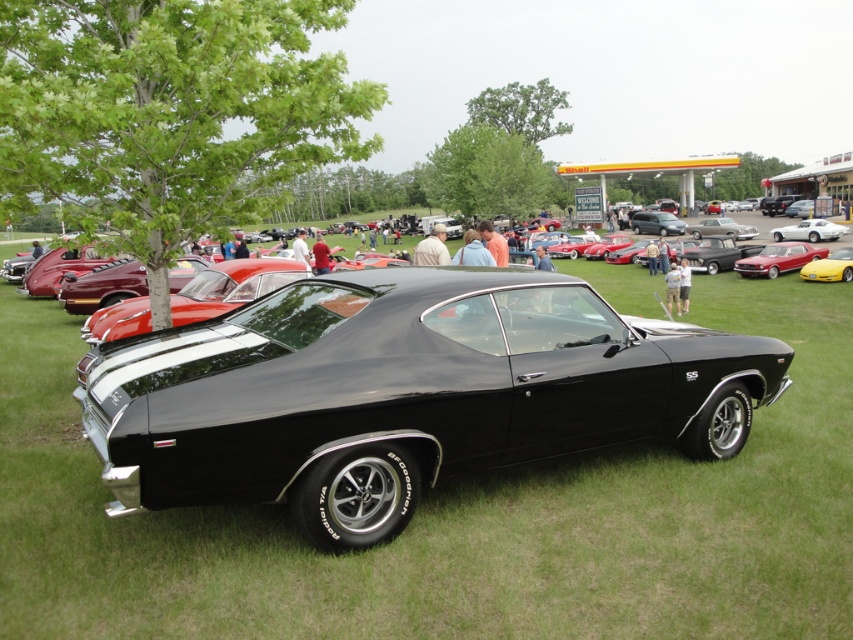
You are a photographer positioned at the origin point of the coordinate system. You want to capture a photo of the black glossy car at center. Which direction should you move to get closer to the car?

The black glossy car at center is located at point (405,394), so you should move towards the positive x and positive y direction to get closer to the car.

You are a photographer trying to capture a wide shot of the car show. You need to position yourself so that both the shiny red car at center right and the shiny silver sedan at center are fully visible in your frame. Given their widths, which car will require you to stand further back to ensure it fits entirely in the photo?

The shiny silver sedan at center is wider than the shiny red car at center right. To ensure the wider shiny silver sedan at center fits entirely in the photo, you will need to stand further back compared to if you were only photographing the thinner shiny red car at center right.